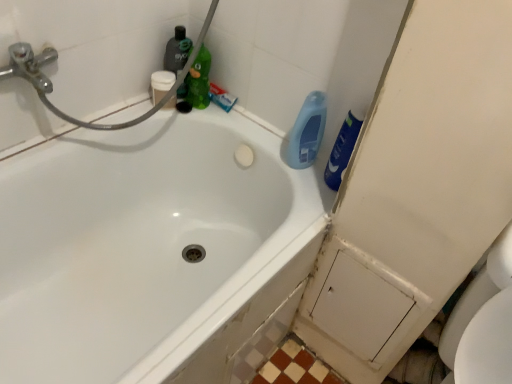
Question: In which direction should I rotate to look at green matte bottle at upper center, which is the 2th cleaning product from left to right?

Choices:
 (A) left
 (B) right

Answer: (A)

Question: Can you confirm if green matte bottle at upper center, which is the 2th cleaning product from left to right, is bigger than translucent green bottle at upper center, the fourth cleaning product from the right?

Choices:
 (A) yes
 (B) no

Answer: (A)

Question: Does green matte bottle at upper center, the third cleaning product from the right, have a greater width compared to translucent green bottle at upper center, marked as the first cleaning product in a left-to-right arrangement?

Choices:
 (A) yes
 (B) no

Answer: (A)

Question: Does green matte bottle at upper center, the third cleaning product from the right, have a smaller size compared to translucent green bottle at upper center, the fourth cleaning product from the right?

Choices:
 (A) yes
 (B) no

Answer: (B)

Question: Is green matte bottle at upper center, the third cleaning product from the right, positioned in front of translucent green bottle at upper center, the fourth cleaning product from the right?

Choices:
 (A) no
 (B) yes

Answer: (B)

Question: Is green matte bottle at upper center, which is the 2th cleaning product from left to right, taller than translucent green bottle at upper center, marked as the first cleaning product in a left-to-right arrangement?

Choices:
 (A) yes
 (B) no

Answer: (B)

Question: Is green matte bottle at upper center, the third cleaning product from the right, with translucent green bottle at upper center, the fourth cleaning product from the right?

Choices:
 (A) yes
 (B) no

Answer: (A)

Question: Would you say blue glossy bottle at upper right, the first cleaning product from the right, is part of white matte cup at upper left's contents?

Choices:
 (A) no
 (B) yes

Answer: (A)

Question: Does white matte cup at upper left lie in front of blue glossy bottle at upper right, the first cleaning product from the right?

Choices:
 (A) no
 (B) yes

Answer: (A)

Question: Is white matte cup at upper left at the right side of blue glossy bottle at upper right, acting as the 4th cleaning product starting from the left?

Choices:
 (A) no
 (B) yes

Answer: (A)

Question: Is white matte cup at upper left to the left of blue glossy bottle at upper right, the first cleaning product from the right, from the viewer's perspective?

Choices:
 (A) yes
 (B) no

Answer: (A)

Question: Is white matte cup at upper left oriented away from blue glossy bottle at upper right, acting as the 4th cleaning product starting from the left?

Choices:
 (A) no
 (B) yes

Answer: (A)

Question: Is white matte cup at upper left in contact with blue glossy bottle at upper right, acting as the 4th cleaning product starting from the left?

Choices:
 (A) yes
 (B) no

Answer: (B)

Question: Could you tell me if green matte bottle at upper center, the third cleaning product from the right, is facing blue matte toothpaste at upper center?

Choices:
 (A) no
 (B) yes

Answer: (A)